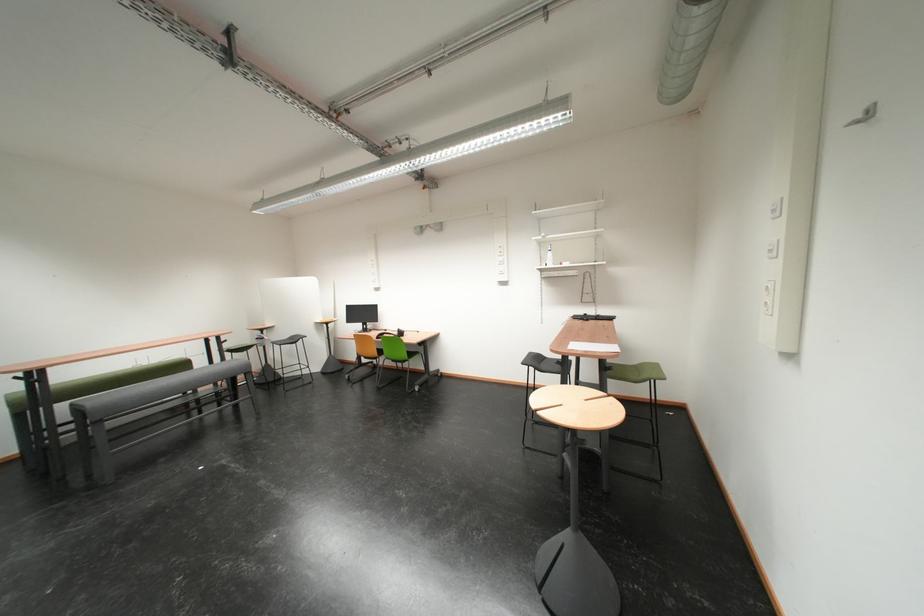
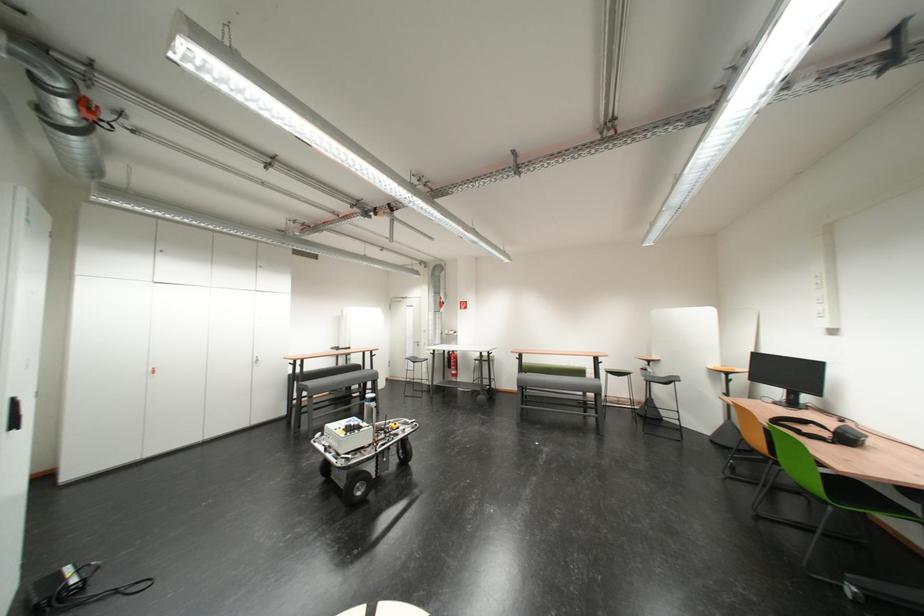
Find the pixel in the second image that matches [237,349] in the first image.

(614, 369)